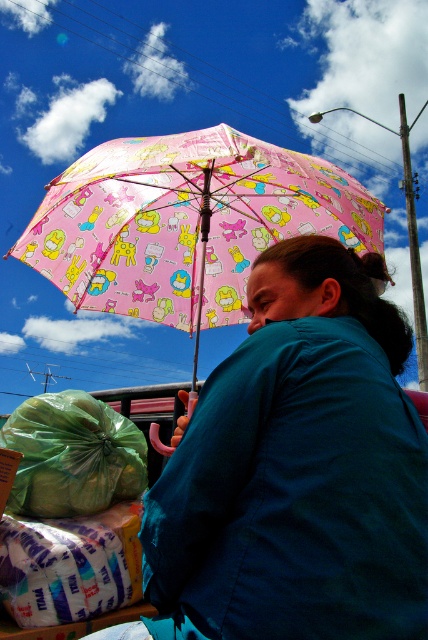
You are a fashion designer observing the image. You need to decide which item would require more fabric to produce between the teal fabric shirt at center and the pink fabric umbrella at upper center. Which one would need more fabric?

The pink fabric umbrella at upper center requires more fabric than the teal fabric shirt at center because it occupies more space, as stated in the description.

You are a photographer trying to capture the person under the pink fabric umbrella at upper center. To ensure the teal fabric shirt at center is visible in the photo, where should you position the umbrella?

The teal fabric shirt at center is positioned under the pink fabric umbrella at upper center, so positioning the umbrella above the shirt will ensure visibility.

You are standing in the scene and want to pick up the green plastic bag at lower left. Which direction should you move relative to the pink fabric umbrella at upper center?

You should move to the left relative to the pink fabric umbrella at upper center because the green plastic bag at lower left is located to the left of it.